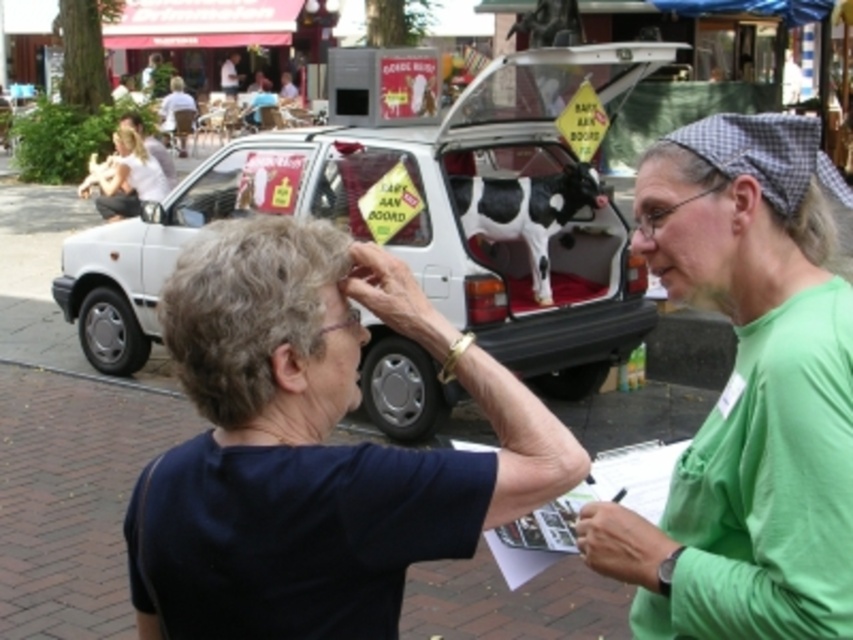
Based on the scene description, can you determine the relative positions of the white matte car at center and the smooth skin forehead at upper center? Which one is positioned to the left?

The white matte car at center is positioned to the left of the smooth skin forehead at upper center.

You are a photographer standing in the scene. You want to take a photo of the dark blue shirt at center and the gray curly hair at upper left. Which one should you focus on first if you want to capture both in the same frame?

The dark blue shirt at center is to the right of gray curly hair at upper left, so you should focus on the gray curly hair at upper left first to ensure both are in the same frame.

Consider the image. You are a delivery person who needs to place a package between the white matte car at center and the white checkered fabric at upper right. Can you fit the package in the space between them if the package requires 10 feet of space?

The white matte car at center and white checkered fabric at upper right are 10.24 feet apart, so yes, the package requiring 10 feet of space can be placed between them since the distance is sufficient.